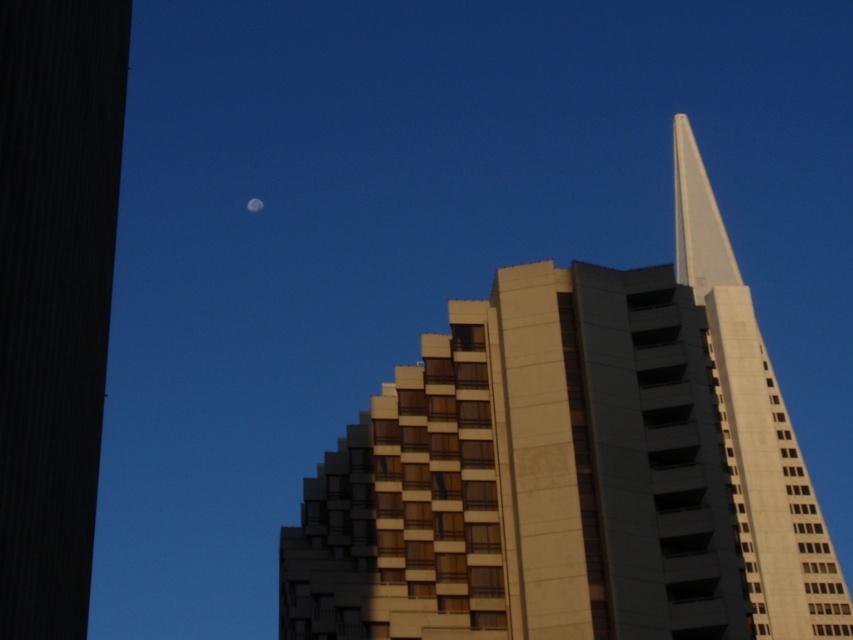
In the scene shown: You are standing at a safe distance from the beige concrete building at center. If the recommended safe distance for taking a photo of this building is 150 feet, can you safely take a photo from your current position?

The beige concrete building at center is 153.59 feet away from the viewer, which is slightly beyond the recommended 150 feet safe distance. Therefore, you are at a safe distance to take the photo.

You are a drone operator trying to locate the beige concrete building at center. According to the coordinates provided, where would you find it in the image?

The beige concrete building at center is located at point (570, 480) in the image.

You are an architect analyzing the urban scene. You notice the beige concrete building at center and the silvery reflective moon at upper center. Which object appears taller in the image?

The beige concrete building at center appears taller than the silvery reflective moon at upper center in the image.